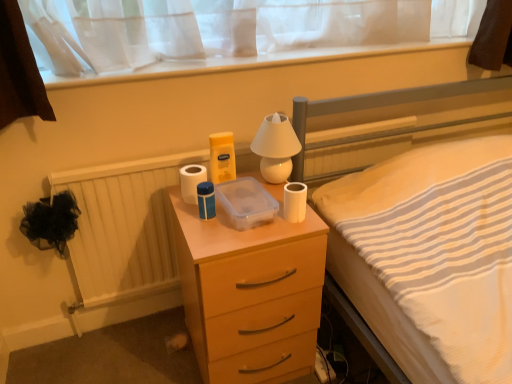
Question: Considering the positions of point (272, 122) and point (263, 240), is point (272, 122) closer or farther from the camera than point (263, 240)?

Choices:
 (A) closer
 (B) farther

Answer: (B)

Question: From their relative heights in the image, would you say white glossy lamp at upper center is taller or shorter than matte wood chest of drawers at center?

Choices:
 (A) tall
 (B) short

Answer: (B)

Question: Estimate the real-world distances between objects in this image. Which object is farther from the white matte toilet paper at right, arranged as the first toilet paper when viewed from the front?

Choices:
 (A) matte wood chest of drawers at center
 (B) white glossy lamp at upper center
 (C) white striped fabric at upper right
 (D) white matte toilet paper at center, the second toilet paper from the right

Answer: (C)

Question: Based on their relative distances, which object is farther from the matte wood chest of drawers at center?

Choices:
 (A) white matte toilet paper at center, positioned as the first toilet paper in left-to-right order
 (B) white striped fabric at upper right
 (C) white glossy lamp at upper center
 (D) white matte toilet paper at right, arranged as the first toilet paper when viewed from the front

Answer: (B)